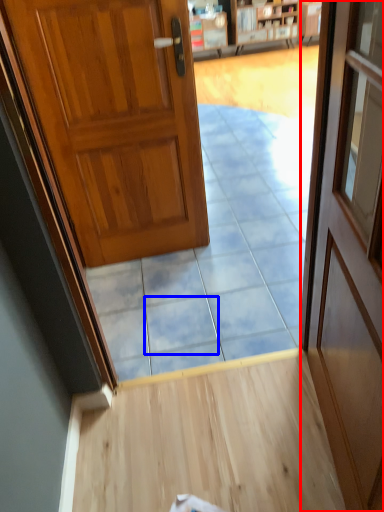
Question: Which point is closer to the camera, door (highlighted by a red box) or tile (highlighted by a blue box)?

Choices:
 (A) door
 (B) tile

Answer: (A)